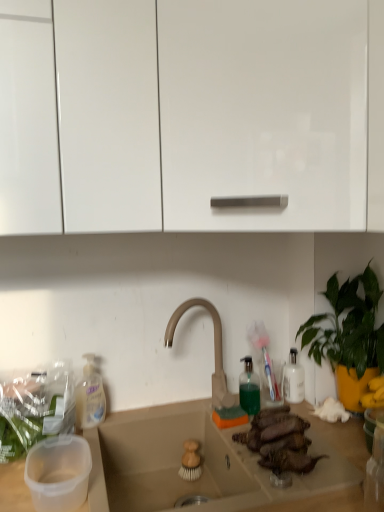
Locate an element on the screen. The width and height of the screenshot is (384, 512). vacant region to the right of brown matte meat at center is located at coordinates (331, 452).